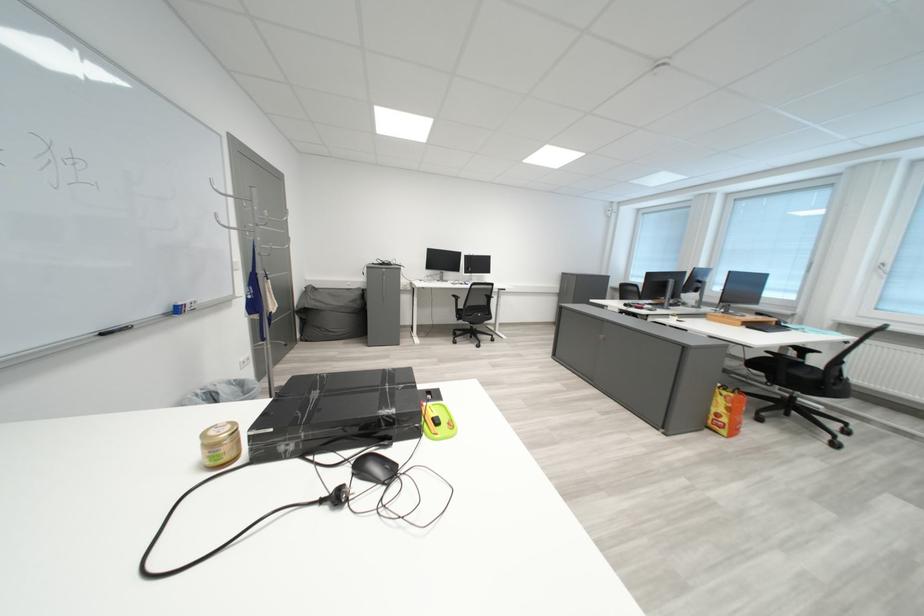
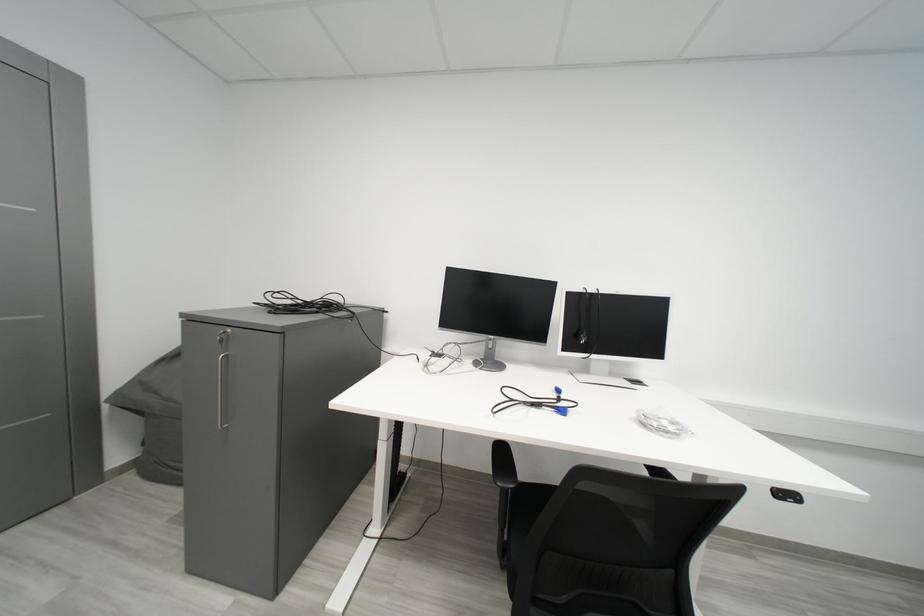
Question: What movement of the cameraman would produce the second image?

Choices:
 (A) Left
 (B) Right
 (C) Forward
 (D) Backward

Answer: (C)